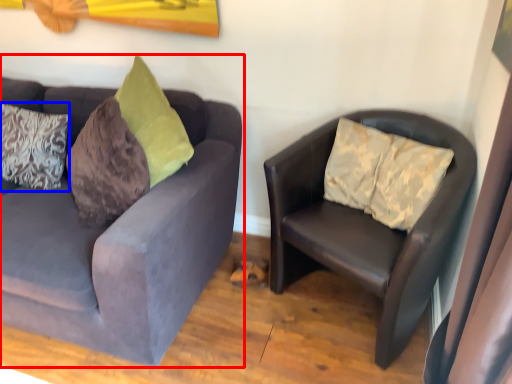
Question: Among these objects, which one is farthest to the camera, studio couch (highlighted by a red box) or pillow (highlighted by a blue box)?

Choices:
 (A) studio couch
 (B) pillow

Answer: (B)